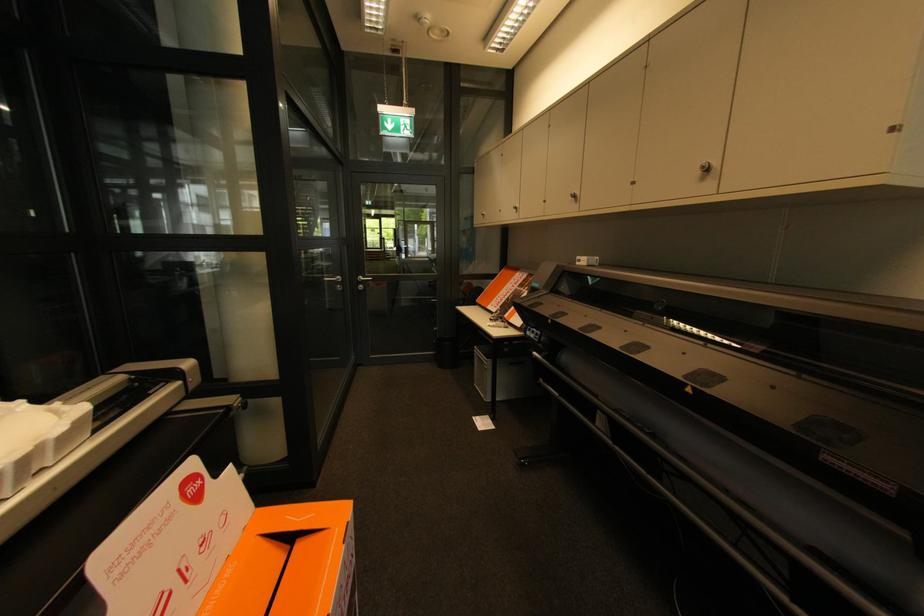
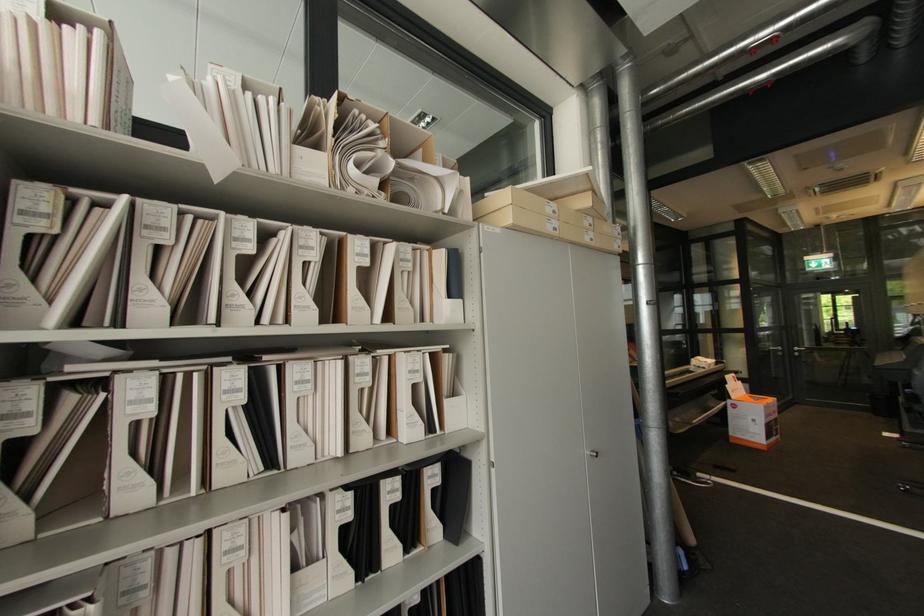
Find the pixel in the second image that matches the point at 365,286 in the first image.

(800, 354)